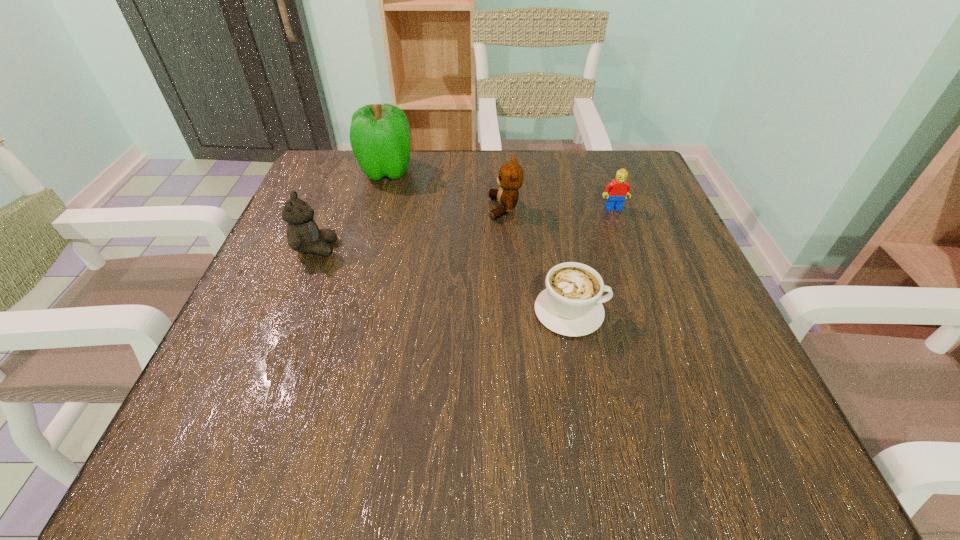
Locate an element on the screen. This screenshot has height=540, width=960. vacant space located 0.220m on the right of the tallest object is located at coordinates [509, 171].

Image resolution: width=960 pixels, height=540 pixels. I want to click on vacant space located 0.340m on the face of the left teddy bear, so click(x=514, y=248).

Where is `vacant region located on the front-facing side of the third object from left to right`? The height and width of the screenshot is (540, 960). vacant region located on the front-facing side of the third object from left to right is located at coordinates (446, 208).

Find the location of `blank area located 0.300m on the front-facing side of the third object from left to right`. blank area located 0.300m on the front-facing side of the third object from left to right is located at coordinates (348, 208).

In order to click on vacant space located 0.130m on the front-facing side of the third object from left to right in this screenshot , I will do (427, 208).

Locate an element on the screen. The height and width of the screenshot is (540, 960). free space located on the face of the fourth tallest object is located at coordinates (658, 332).

Locate an element on the screen. This screenshot has width=960, height=540. free point located to the right of the nearest object's handle is located at coordinates (660, 311).

This screenshot has height=540, width=960. In order to click on bell pepper that is at the far edge in this screenshot , I will do `click(379, 134)`.

Image resolution: width=960 pixels, height=540 pixels. Find the location of `teddy bear that is at the far edge`. teddy bear that is at the far edge is located at coordinates (510, 179).

You are a GUI agent. You are given a task and a screenshot of the screen. Output one action in this format:
    pyautogui.click(x=<x>, y=<y>)
    Task: Click on the Lego that is at the far edge
    The image size is (960, 540).
    Given the screenshot: What is the action you would take?
    pyautogui.click(x=616, y=191)